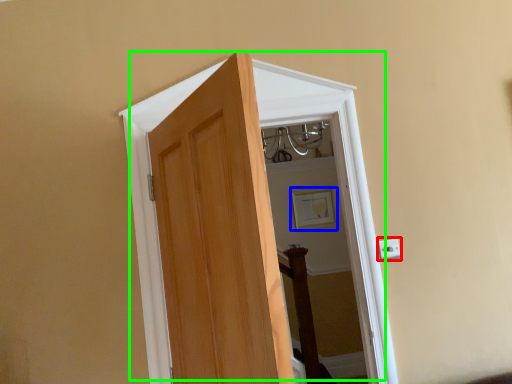
Question: Which object is the farthest from electric outlet (highlighted by a red box)? Choose among these: picture frame (highlighted by a blue box) or door (highlighted by a green box).

Choices:
 (A) picture frame
 (B) door

Answer: (A)